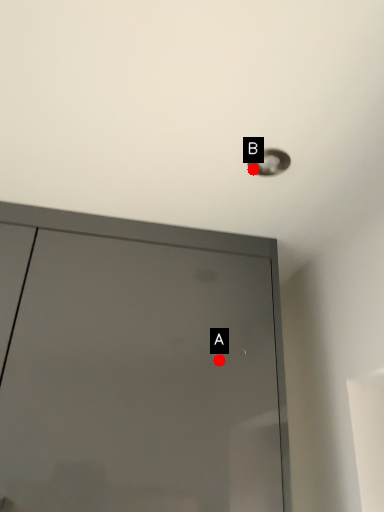
Question: Two points are circled on the image, labeled by A and B beside each circle. Which point is closer to the camera?

Choices:
 (A) A is closer
 (B) B is closer

Answer: (B)